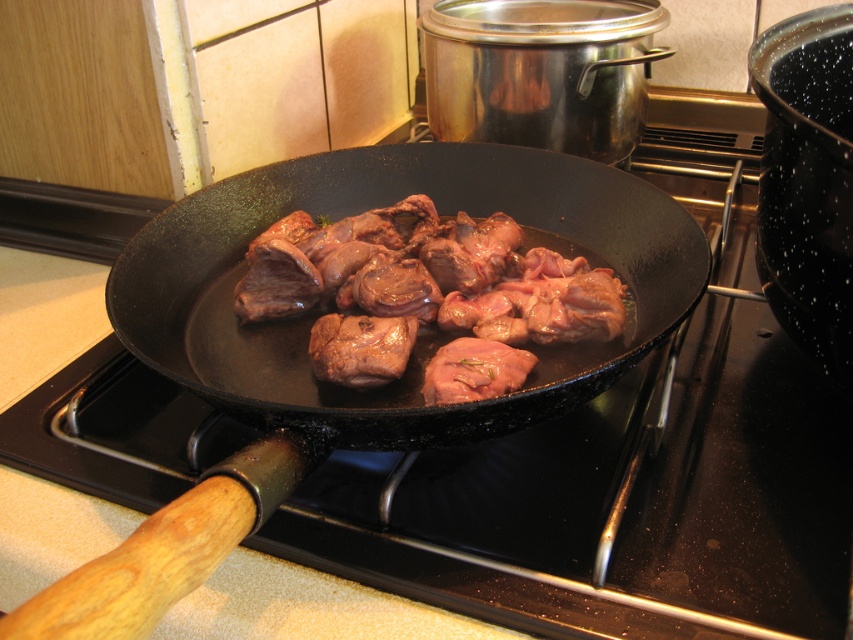
Based on the photo, you are a chef trying to flip the brown glossy meat at center in the black matte wok at center. Can you do it without moving the wok?

The black matte wok at center is to the left of brown glossy meat at center, so you can flip the brown glossy meat at center without moving the wok since they are positioned next to each other.

You are a chef trying to flip the brown glossy meat at center in the black matte wok at center. Can you see the meat clearly to ensure it is cooked evenly?

The black matte wok at center is in front of brown glossy meat at center, so the wok is blocking the view of the meat, making it difficult to see clearly to ensure even cooking.